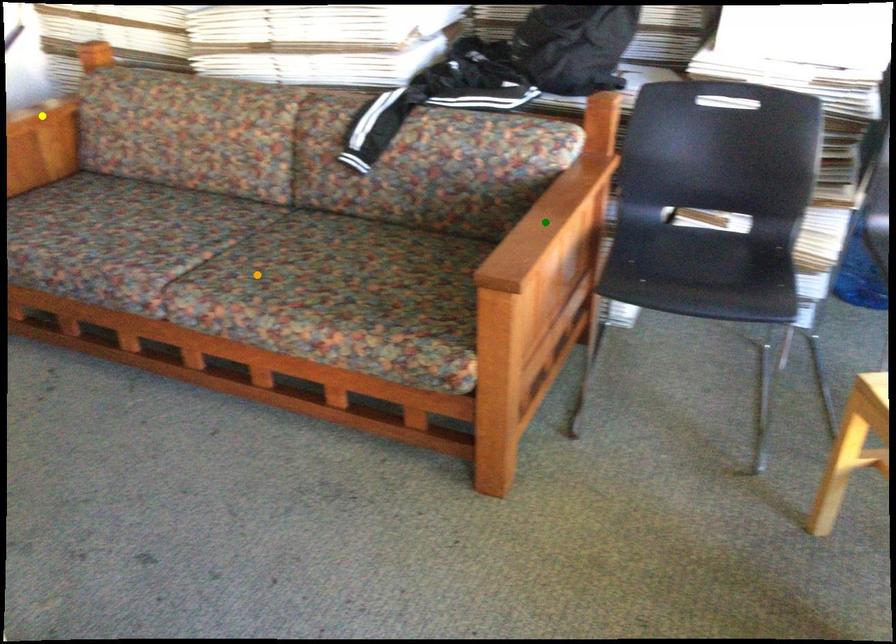
Order these from nearest to farthest:
orange point, green point, yellow point

yellow point, orange point, green point